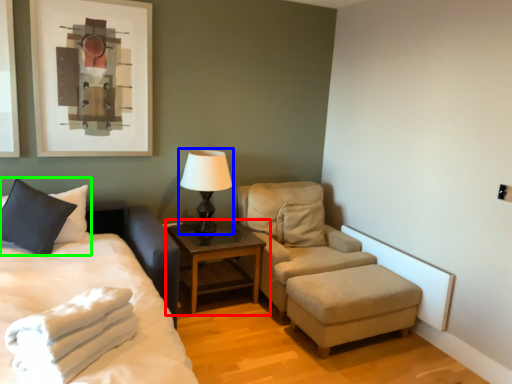
Question: Based on their relative distances, which object is nearer to table (highlighted by a red box)? Choose from table lamp (highlighted by a blue box) and pillow (highlighted by a green box).

Choices:
 (A) table lamp
 (B) pillow

Answer: (A)